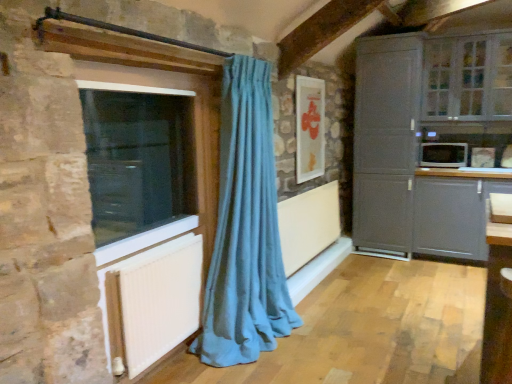
What are the coordinates of `vacant space in front of matte gray cabinet at right` in the screenshot? It's located at (408, 269).